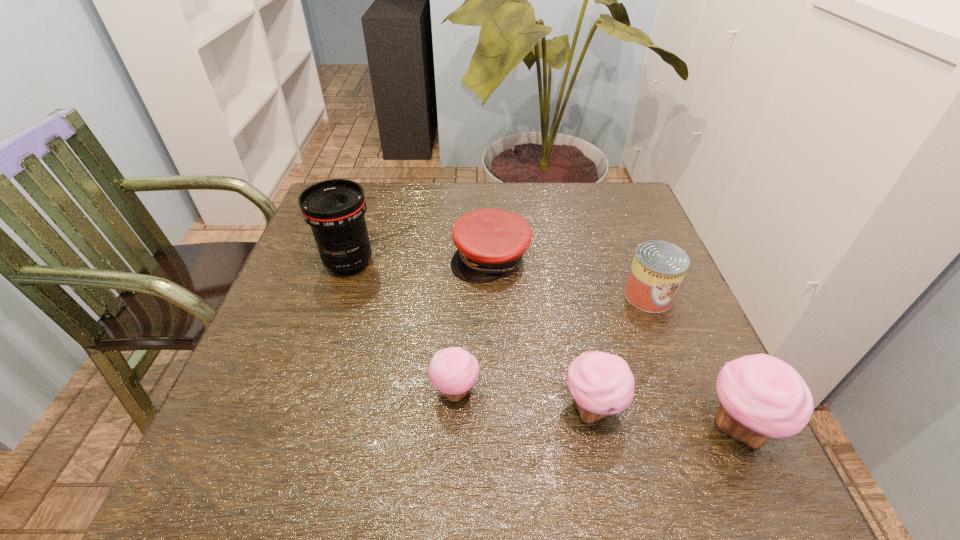
Identify the location of vacant space located on the left of the third object from right to left. (399, 408).

At what (x,y) coordinates should I click in order to perform the action: click on free space located on the left of the rightmost cupcake. Please return your answer as a coordinate pair (x, y). The height and width of the screenshot is (540, 960). Looking at the image, I should click on coord(555,427).

Find the location of a particular element. The width and height of the screenshot is (960, 540). vacant area situated 0.250m on the front-facing side of the cap is located at coordinates (493, 375).

Identify the location of free space located 0.270m on the back of the can. (616, 213).

Image resolution: width=960 pixels, height=540 pixels. Find the location of `free spot located on the right of the telephoto lens`. free spot located on the right of the telephoto lens is located at coordinates (529, 263).

Locate an element on the screen. This screenshot has width=960, height=540. object positioned at the left edge is located at coordinates (335, 208).

I want to click on cupcake at the right edge, so click(x=762, y=397).

At what (x,y) coordinates should I click in order to perform the action: click on can that is positioned at the right edge. Please return your answer as a coordinate pair (x, y). This screenshot has width=960, height=540. Looking at the image, I should click on pos(658,268).

Find the location of a particular element. object that is at the near right corner is located at coordinates (762, 397).

Find the location of a particular element. Image resolution: width=960 pixels, height=540 pixels. free space at the far edge of the desktop is located at coordinates (523, 207).